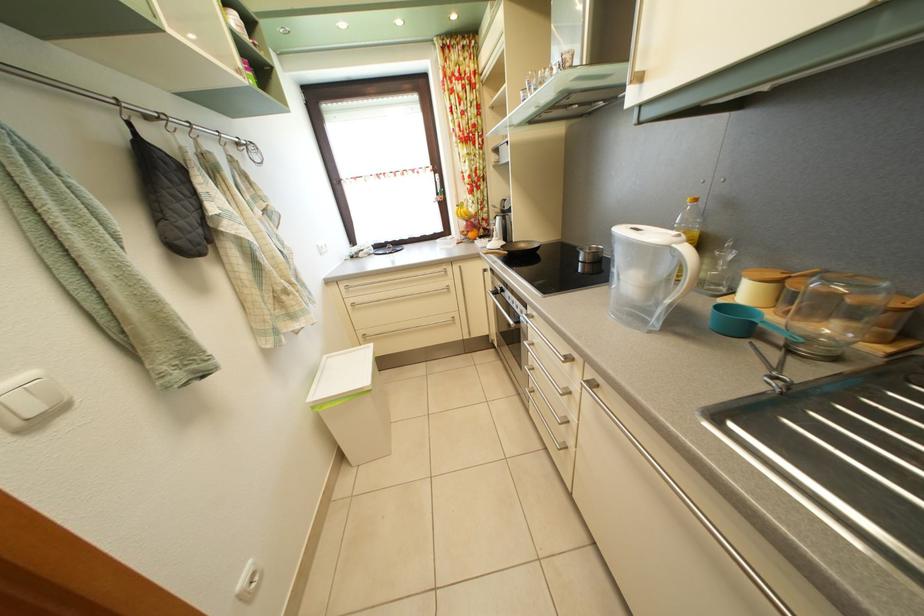
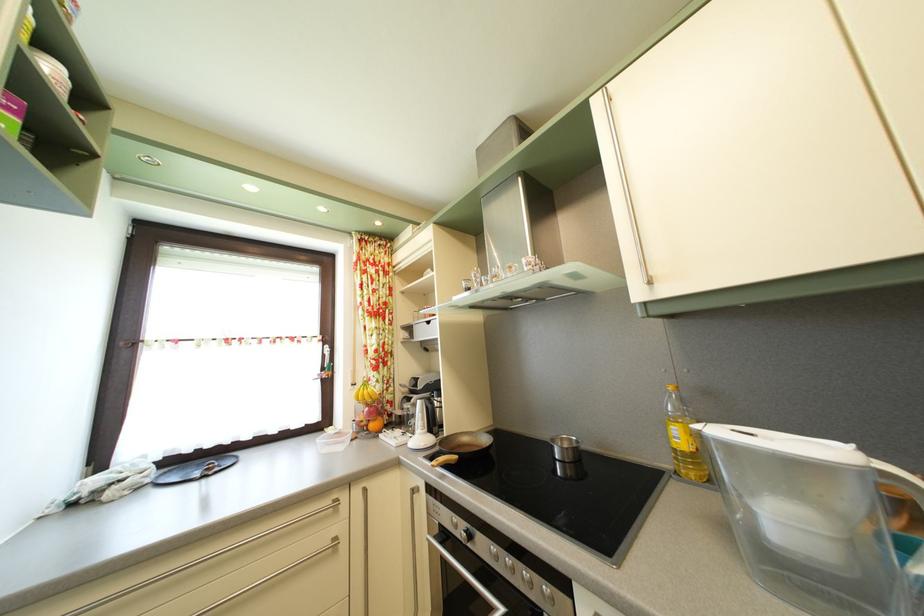
The point at [505,225] is marked in the first image. Where is the corresponding point in the second image?

(417, 407)